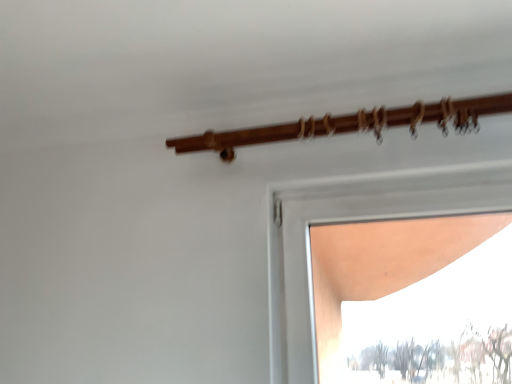
You are a GUI agent. You are given a task and a screenshot of the screen. Output one action in this format:
    pyautogui.click(x=<x>, y=<y>)
    Task: Click on the wooden rod at upper center
    
    Given the screenshot: What is the action you would take?
    pyautogui.click(x=351, y=124)

This screenshot has height=384, width=512. Describe the element at coordinates (351, 124) in the screenshot. I see `wooden rod at upper center` at that location.

Identify the location of wooden rod at upper center. The width and height of the screenshot is (512, 384). (351, 124).